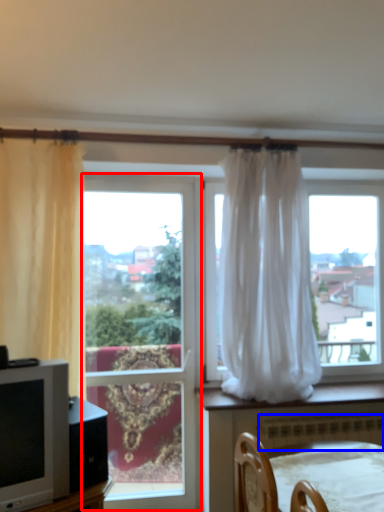
Question: Which object is closer to the camera taking this photo, window (highlighted by a red box) or radiator (highlighted by a blue box)?

Choices:
 (A) window
 (B) radiator

Answer: (B)